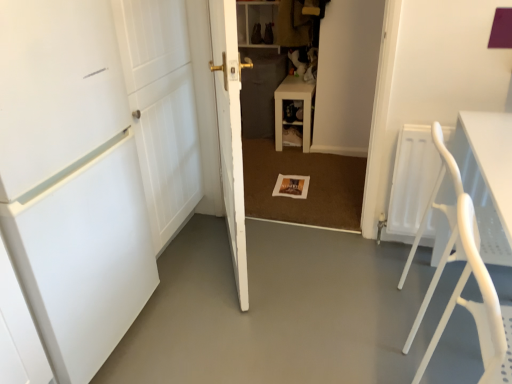
Locate an element on the screen. This screenshot has height=384, width=512. free space between white matte door at center, the second door when ordered from left to right, and white plastic folding chair at right is located at coordinates (324, 282).